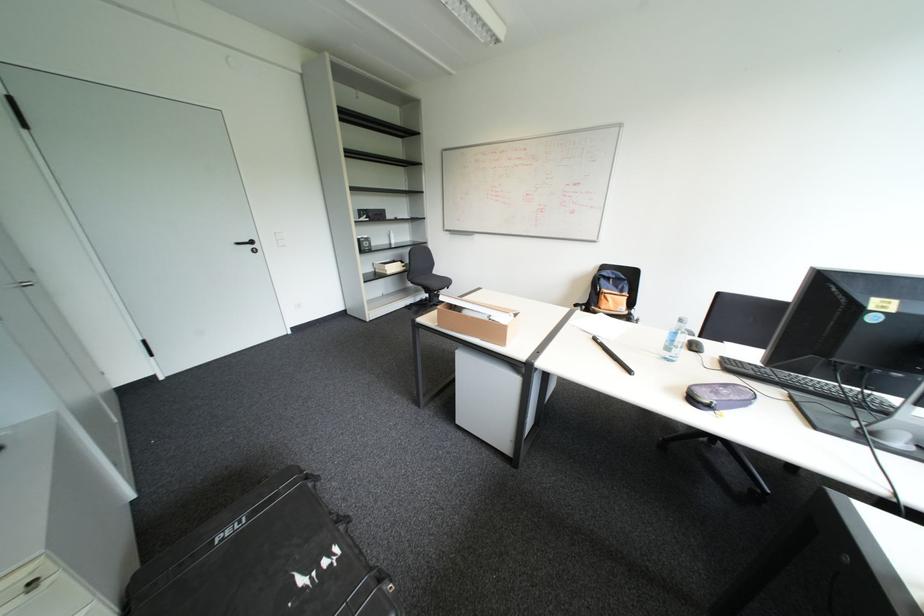
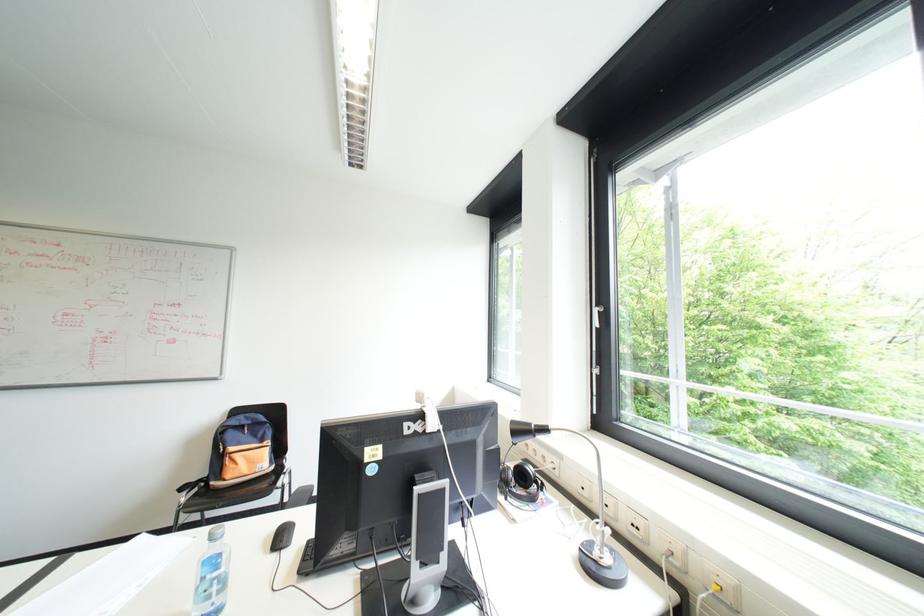
Question: The camera is either moving clockwise (left) or counter-clockwise (right) around the object. The first image is from the beginning of the video and the second image is from the end. Is the camera moving left or right when shooting the video?

Choices:
 (A) Left
 (B) Right

Answer: (A)